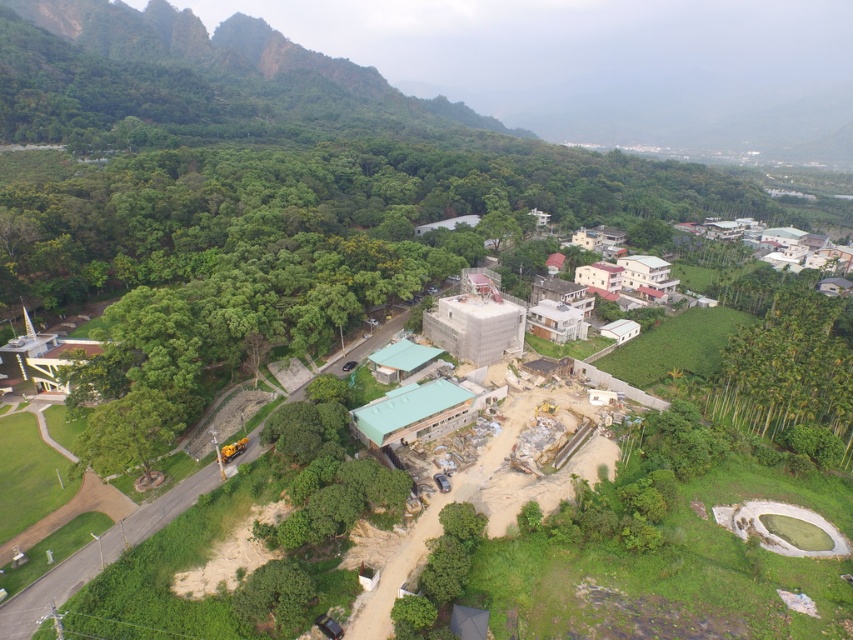
Question: Observing the image, what is the correct spatial positioning of green leafy trees at lower right in reference to white matte houses at center-right?

Choices:
 (A) right
 (B) left

Answer: (A)

Question: Where is green leafy trees at lower right located in relation to white matte houses at center-right in the image?

Choices:
 (A) above
 (B) below

Answer: (B)

Question: Which point is farther to the camera?

Choices:
 (A) (746, 380)
 (B) (544, 296)

Answer: (B)

Question: In this image, where is green leafy trees at lower right located relative to white matte houses at center-right?

Choices:
 (A) left
 (B) right

Answer: (B)

Question: Among these points, which one is farthest from the camera?

Choices:
 (A) (633, 256)
 (B) (813, 310)

Answer: (A)